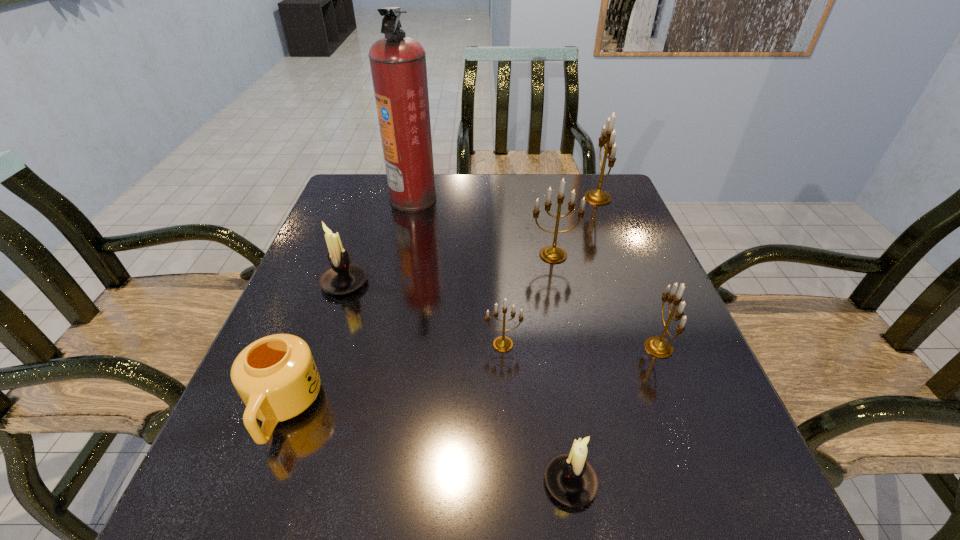
Where is `free space located 0.060m on the front of the smallest gold candelabrum`? The height and width of the screenshot is (540, 960). free space located 0.060m on the front of the smallest gold candelabrum is located at coordinates (505, 379).

Locate an element on the screen. The width and height of the screenshot is (960, 540). vacant space positioned 0.110m on the handle side of the mug is located at coordinates (237, 531).

I want to click on fire extinguisher that is at the far edge, so click(398, 63).

The width and height of the screenshot is (960, 540). In order to click on candelabrum that is at the far edge in this screenshot , I will do `click(597, 197)`.

Identify the location of object that is positioned at the near edge. The image size is (960, 540). (571, 480).

Image resolution: width=960 pixels, height=540 pixels. What are the coordinates of `fire extinguisher that is positioned at the left edge` in the screenshot? It's located at (398, 63).

This screenshot has height=540, width=960. I want to click on candle holder that is at the left edge, so click(x=343, y=277).

Where is `mug at the left edge`? The width and height of the screenshot is (960, 540). mug at the left edge is located at coordinates click(x=276, y=377).

Identify the location of object that is at the far left corner. (398, 63).

The height and width of the screenshot is (540, 960). In order to click on object present at the far right corner in this screenshot , I will do `click(597, 197)`.